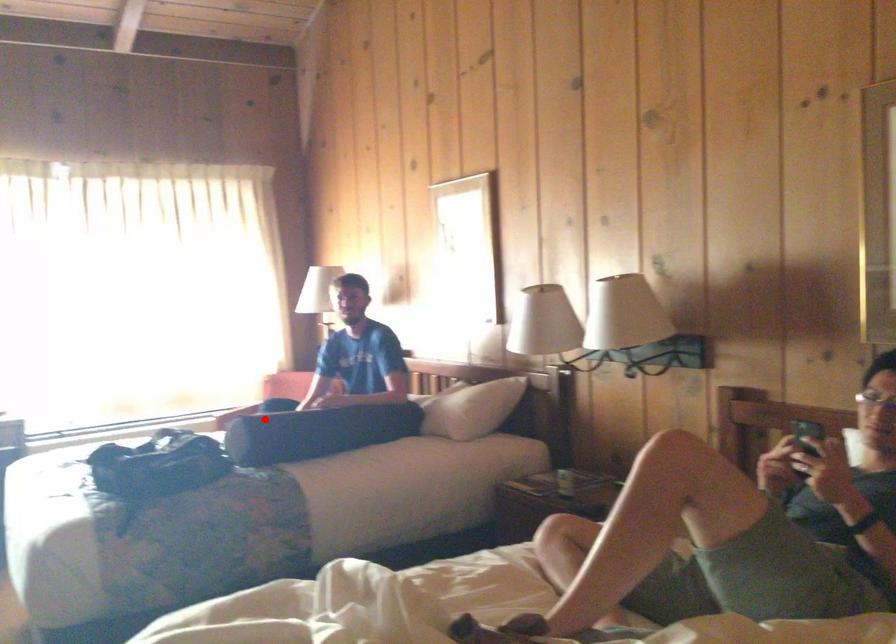
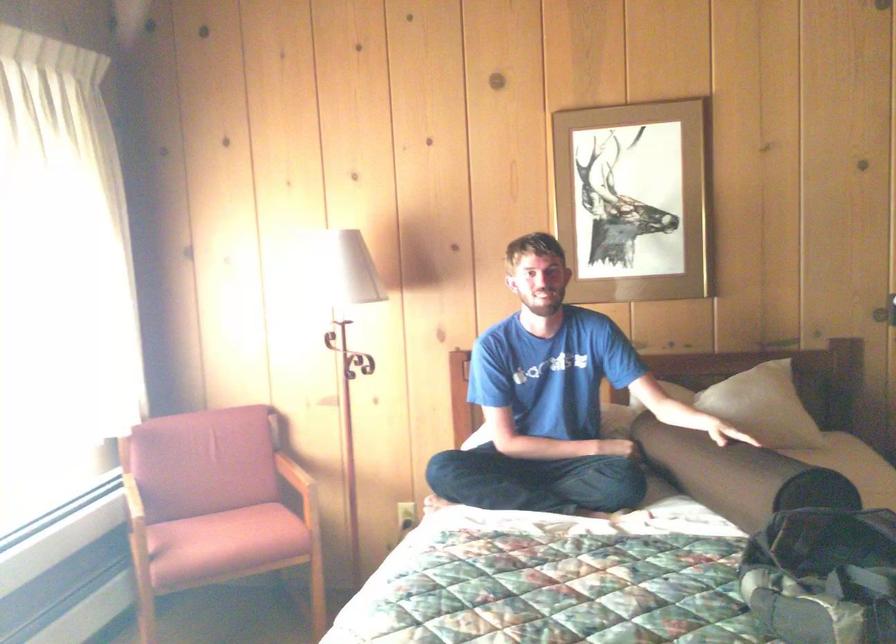
Question: I am providing you with two images of the same scene from different viewpoints. Given a red point in image1, look at the same physical point in image2. Is it:

Choices:
 (A) Closer to the viewpoint
 (B) Farther from the viewpoint

Answer: (A)